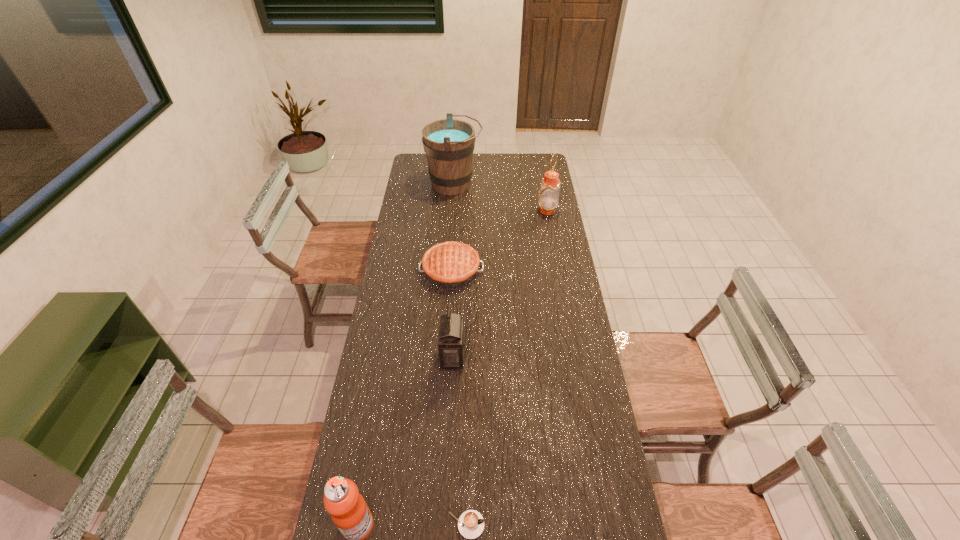
This screenshot has height=540, width=960. I want to click on empty space between the oil lamp and the farthest object, so click(x=501, y=197).

The height and width of the screenshot is (540, 960). What are the coordinates of `vacant area that lies between the pie and the wine bucket` in the screenshot? It's located at (453, 227).

Identify the location of the third closest object to the cappuccino. The image size is (960, 540). (451, 264).

At what (x,y) coordinates should I click in order to perform the action: click on object that is the second closest to the shortest object. Please return your answer as a coordinate pair (x, y). The height and width of the screenshot is (540, 960). Looking at the image, I should click on (451, 335).

Identify the location of vacant area that satisfies the following two spatial constraints: 1. with a handle on the side of the rightmost object; 2. on the right side of the farthest object. Image resolution: width=960 pixels, height=540 pixels. (452, 210).

This screenshot has height=540, width=960. In order to click on vacant space that satisfies the following two spatial constraints: 1. with a handle on the side of the second shortest object; 2. on the right side of the wine bucket in this screenshot , I will do `click(448, 270)`.